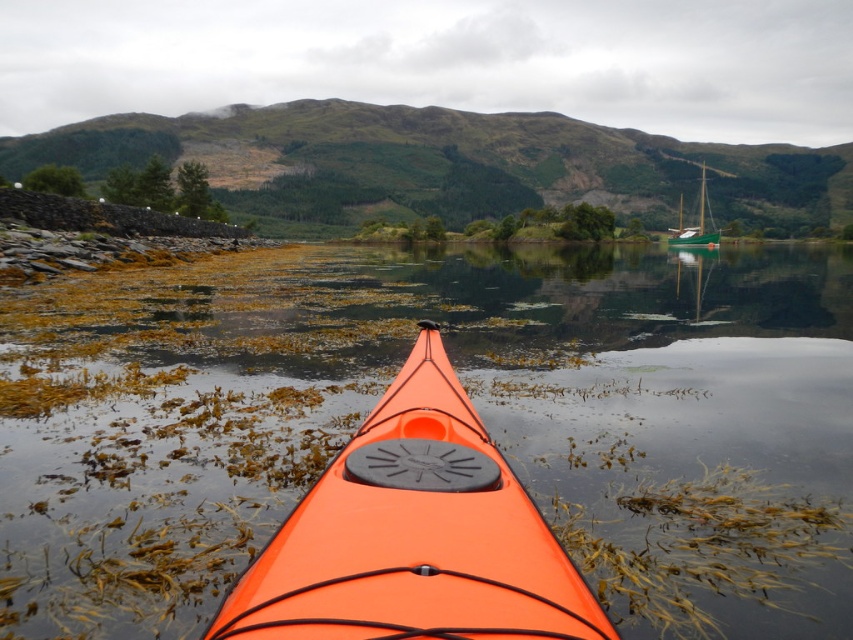
You are in a kayak and want to avoid hitting the translucent seaweed at center. Based on your current position, where should you steer to avoid it?

The translucent seaweed at center is located at point 0.633 on the x axis and 0.556 on the y axis. To avoid it, steer your kayak away from those coordinates.

You are in the orange matte kayak at center and notice the translucent seaweed at center. From your viewpoint, does the seaweed appear to be floating above or below the kayak?

The translucent seaweed at center is positioned over orange matte kayak at center, so from your viewpoint in the kayak, the seaweed appears to be floating above the kayak.

You are in the orange matte kayak at center and want to get a closer look at the green glossy sailboat at right. Based on the scene, can you determine if you need to move forward or backward to approach the sailboat?

The orange matte kayak at center is in front of the green glossy sailboat at right, so to approach the sailboat, you would need to move backward.